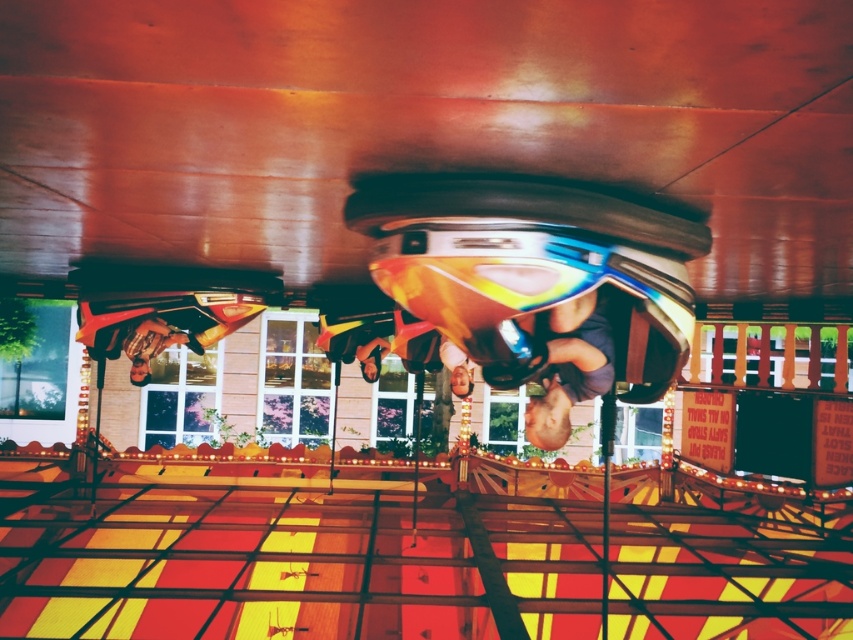
You are a fairground safety inspector checking the helmets on the carousel. You notice the matte blue helmet at center and the metallic gold helmet at left. Which helmet is closer to the front of the ride?

The matte blue helmet at center is closer to the front of the ride because it is in front of the metallic gold helmet at left.

You are a safety inspector checking the helmets on the carousel. You notice two helmets, the matte blue helmet at center and the metallic gold helmet at left. Which helmet has a smaller width?

The matte blue helmet at center has a lesser width compared to the metallic gold helmet at left, so the matte blue helmet at center is smaller in width.

You are a safety inspector checking the distance between the matte blue helmet at center and the metallic gold helmet at left on the carousel. The safety regulation requires a minimum distance of 3 meters between helmets for safety. Is the current distance compliant with the regulation?

The matte blue helmet at center is 3.18 meters away from the metallic gold helmet at left, which exceeds the required 3 meters, so it is compliant with the safety regulation.